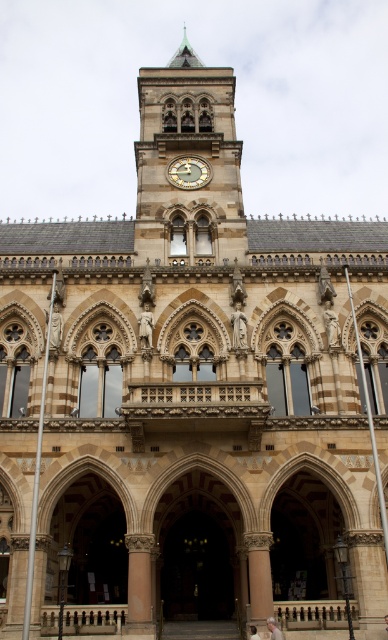
Consider the image. You are an architect examining the grand historic building. You notice the golden polished clock tower at center and the wooden clock face at center. Which of these two objects is larger in size?

The golden polished clock tower at center is bigger than the wooden clock face at center, so the golden polished clock tower at center is larger in size.

You are standing in front of the historic building and notice two items at the center. Which one is located higher up, the golden polished clock tower at center or the light brown leather jacket at center?

The golden polished clock tower at center is positioned over the light brown leather jacket at center, so it is higher up.

You are a maintenance worker needing to reach both the golden polished clock tower at center and the wooden clock face at center for repairs. The ladder you have is 7 meters long. Can you safely use the ladder to reach both objects without moving it?

The golden polished clock tower at center and wooden clock face at center are 6.92 meters apart from each other. Since the ladder is 7 meters long, it is slightly longer than the distance between them, so you can safely use the ladder to reach both objects without moving it.